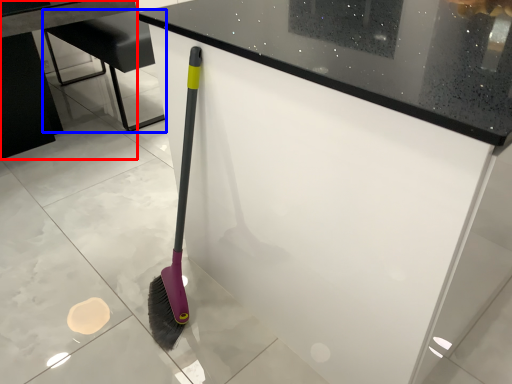
Question: Which object appears closest to the camera in this image, table (highlighted by a red box) or furniture (highlighted by a blue box)?

Choices:
 (A) table
 (B) furniture

Answer: (A)